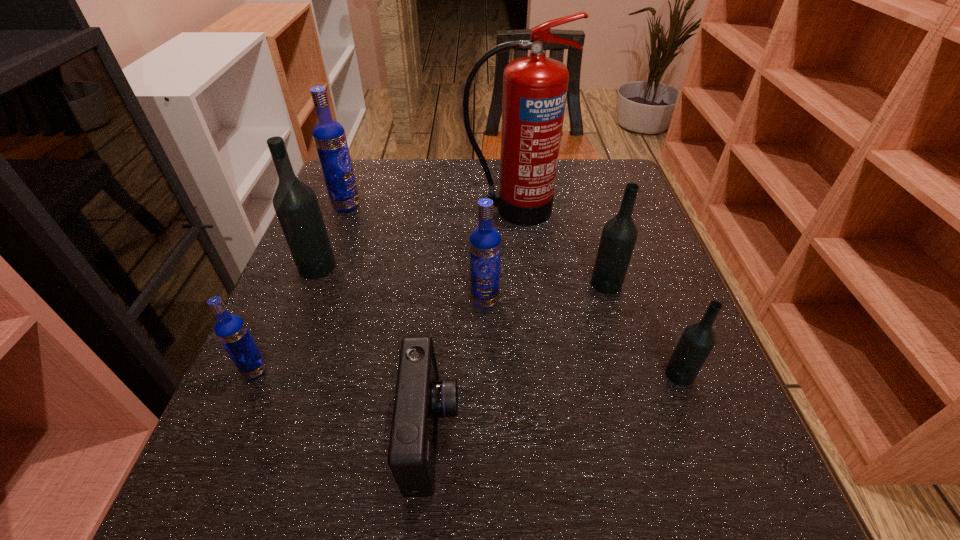
Image resolution: width=960 pixels, height=540 pixels. In the image, there is a desktop. In order to click on vacant space at the far left corner in this screenshot , I will do `click(361, 177)`.

Find the location of a particular element. free space at the far right corner of the desktop is located at coordinates (603, 197).

In order to click on empty location between the biggest blue vodka and the second smallest blue vodka in this screenshot , I will do `click(416, 253)`.

Image resolution: width=960 pixels, height=540 pixels. What are the coordinates of `empty location between the rightmost blue vodka and the second smallest black vodka` in the screenshot? It's located at (545, 292).

Find the location of a particular element. empty space that is in between the fourth vodka from left to right and the biggest blue vodka is located at coordinates click(416, 253).

At what (x,y) coordinates should I click in order to perform the action: click on unoccupied position between the rightmost blue vodka and the leftmost black vodka. Please return your answer as a coordinate pair (x, y). Looking at the image, I should click on (401, 284).

This screenshot has height=540, width=960. In order to click on vacant point located between the farthest vodka and the leftmost black vodka in this screenshot , I will do `click(332, 236)`.

At what (x,y) coordinates should I click in order to perform the action: click on vacant space in between the seventh object from left to right and the rightmost object. Please return your answer as a coordinate pair (x, y). This screenshot has width=960, height=540. Looking at the image, I should click on [x=643, y=329].

The width and height of the screenshot is (960, 540). What are the coordinates of `free spot between the second smallest black vodka and the nearest blue vodka` in the screenshot? It's located at (431, 327).

The width and height of the screenshot is (960, 540). What are the coordinates of `empty location between the biggest blue vodka and the leftmost black vodka` in the screenshot? It's located at (332, 236).